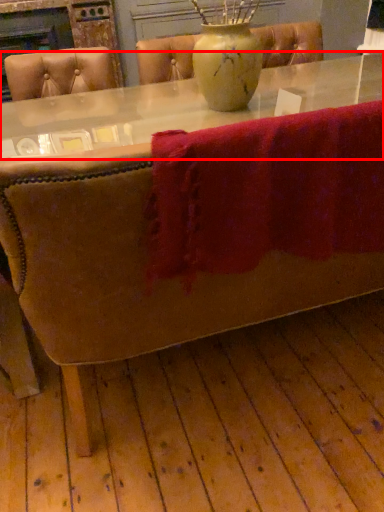
Question: Observing the image, what is the correct spatial positioning of round table (annotated by the red box) in reference to bath towel?

Choices:
 (A) right
 (B) left

Answer: (B)